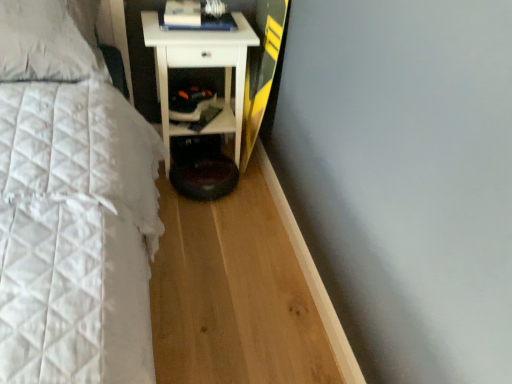
Identify the location of free spot above hardcover book at upper center (from a real-world perspective). This screenshot has height=384, width=512. (200, 16).